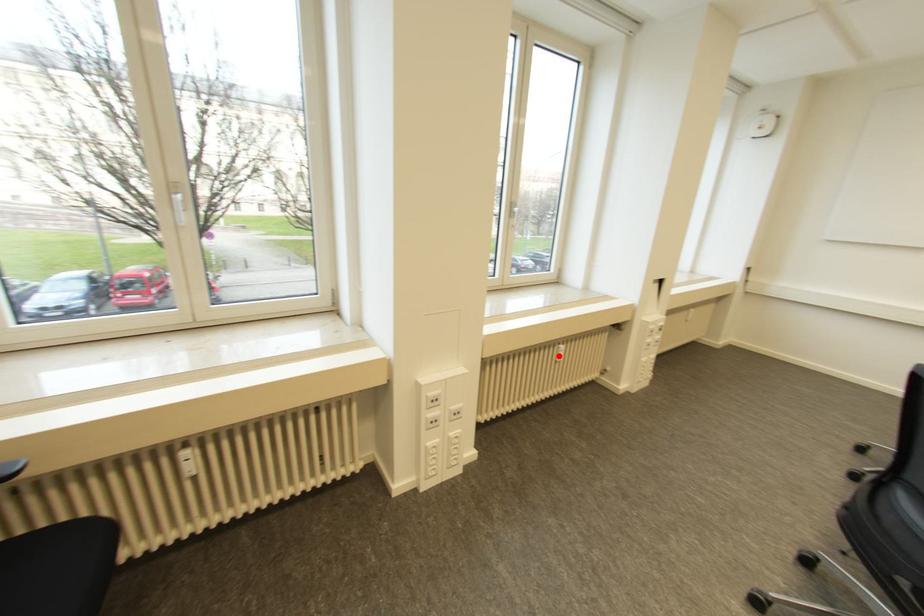
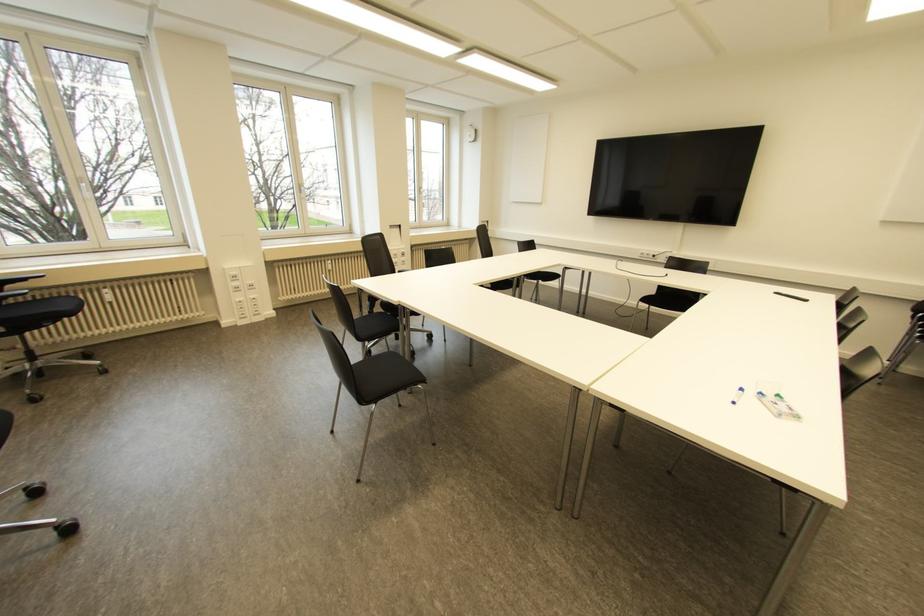
Locate, in the second image, the point that corresponds to the highlighted location in the first image.

(330, 267)